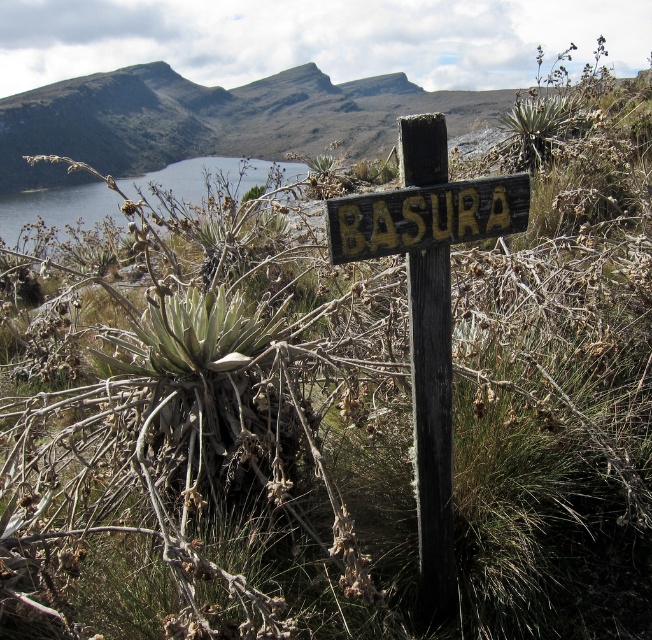
Question: From the image, what is the correct spatial relationship of wooden sign at center in relation to yellow painted wood sign at center?

Choices:
 (A) below
 (B) above

Answer: (A)

Question: Which object is closer to the camera taking this photo?

Choices:
 (A) wooden sign at center
 (B) yellow painted wood sign at center

Answer: (B)

Question: Can you confirm if wooden sign at center is positioned to the left of yellow painted wood sign at center?

Choices:
 (A) no
 (B) yes

Answer: (A)

Question: Which point is closer to the camera?

Choices:
 (A) (445, 310)
 (B) (376, 256)

Answer: (B)

Question: Which object is closer to the camera taking this photo?

Choices:
 (A) wooden sign at center
 (B) yellow painted wood sign at center

Answer: (B)

Question: Can you confirm if wooden sign at center is wider than yellow painted wood sign at center?

Choices:
 (A) yes
 (B) no

Answer: (B)